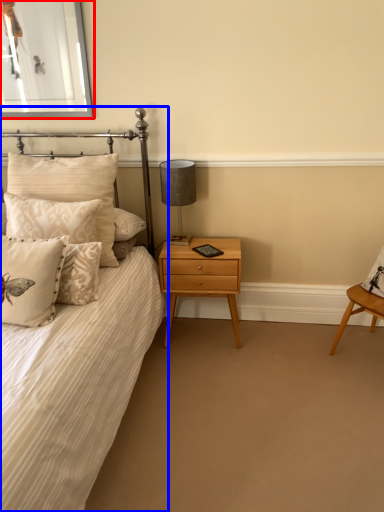
Question: Which object is further to the camera taking this photo, picture frame (highlighted by a red box) or bed (highlighted by a blue box)?

Choices:
 (A) picture frame
 (B) bed

Answer: (A)